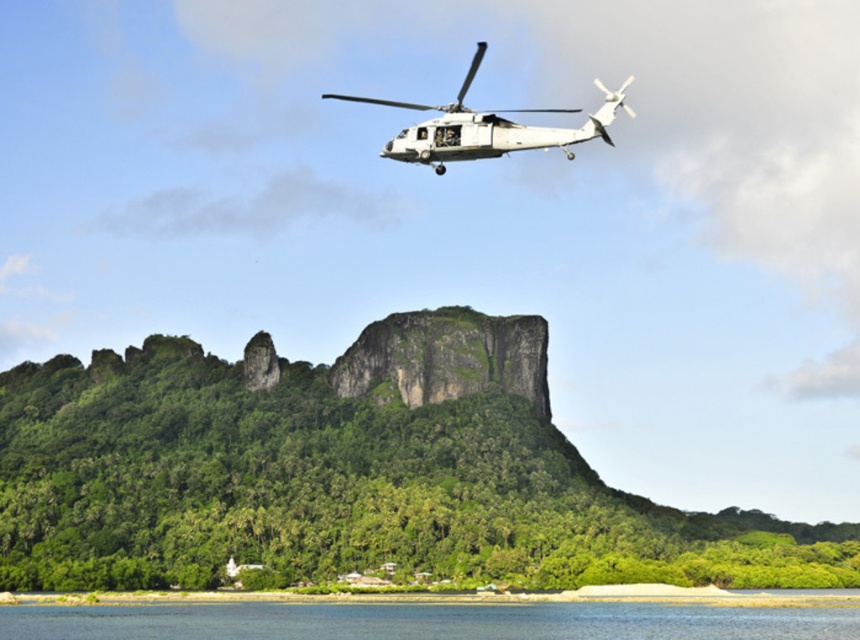
Question: Observing the image, what is the correct spatial positioning of green leafy mountain at center in reference to blue water at lower center?

Choices:
 (A) right
 (B) left

Answer: (B)

Question: Which object is positioned farthest from the green leafy mountain at center?

Choices:
 (A) white matte helicopter at upper center
 (B) blue water at lower center

Answer: (A)

Question: Which point is farther to the camera?

Choices:
 (A) (779, 634)
 (B) (434, 440)

Answer: (B)

Question: Is blue water at lower center below white matte helicopter at upper center?

Choices:
 (A) yes
 (B) no

Answer: (A)

Question: Can you confirm if blue water at lower center is smaller than white matte helicopter at upper center?

Choices:
 (A) no
 (B) yes

Answer: (B)

Question: Based on their relative distances, which object is farther from the green leafy mountain at center?

Choices:
 (A) white matte helicopter at upper center
 (B) blue water at lower center

Answer: (A)